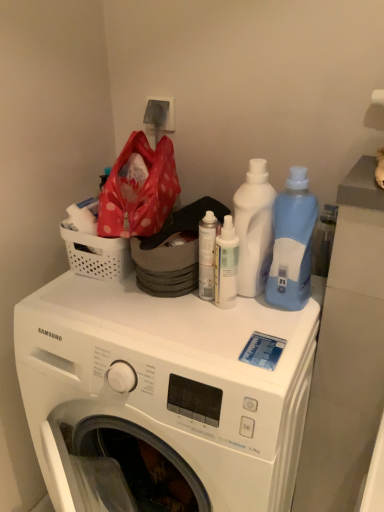
Question: From a real-world perspective, is blue translucent bottle at right, which is the 1th cleaning product in right-to-left order, above or below white glossy spray can at center, arranged as the first cleaning product when viewed from the left?

Choices:
 (A) below
 (B) above

Answer: (B)

Question: From their relative heights in the image, would you say blue translucent bottle at right, which is the 1th cleaning product in right-to-left order, is taller or shorter than white glossy spray can at center, arranged as the 3th cleaning product when viewed from the right?

Choices:
 (A) short
 (B) tall

Answer: (B)

Question: Considering the real-world distances, which object is farthest from the white glossy spray can at center, arranged as the first cleaning product when viewed from the left?

Choices:
 (A) white matte spray can at center
 (B) white plastic bottle at center, acting as the second cleaning product starting from the left
 (C) white perforated basket at upper left
 (D) blue translucent bottle at right, which is the 1th cleaning product in right-to-left order
 (E) white plastic washing machine at center

Answer: (E)

Question: Which of these objects is positioned closest to the white perforated basket at upper left?

Choices:
 (A) white matte spray can at center
 (B) blue translucent bottle at right, acting as the 3th cleaning product starting from the left
 (C) white plastic bottle at center, acting as the second cleaning product starting from the left
 (D) white plastic washing machine at center
 (E) white glossy spray can at center, arranged as the 3th cleaning product when viewed from the right

Answer: (A)